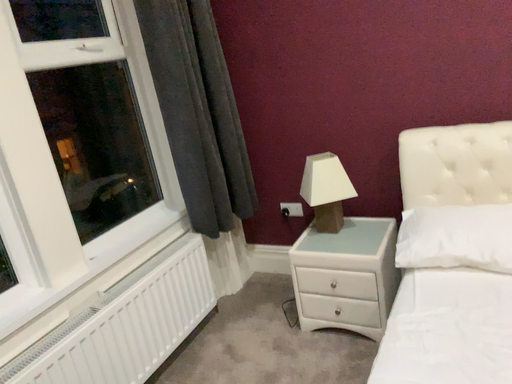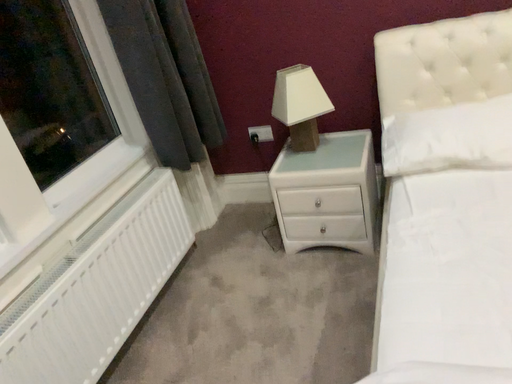
Question: How did the camera likely rotate when shooting the video?

Choices:
 (A) rotated right
 (B) rotated left

Answer: (A)